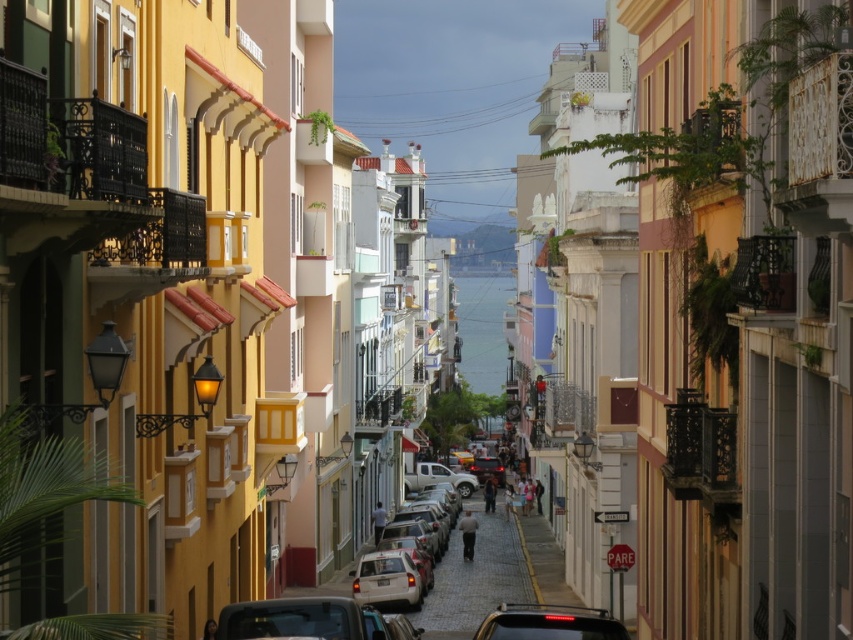
Question: Can you confirm if shiny black car at lower center is thinner than matte silver car at center?

Choices:
 (A) no
 (B) yes

Answer: (A)

Question: Which point appears farthest from the camera in this image?

Choices:
 (A) (376, 600)
 (B) (334, 600)
 (C) (502, 616)

Answer: (A)

Question: Does shiny black car at lower center come in front of matte silver car at center?

Choices:
 (A) no
 (B) yes

Answer: (B)

Question: Among these objects, which one is nearest to the camera?

Choices:
 (A) matte silver car at center
 (B) matte black car at center

Answer: (B)

Question: Can you confirm if shiny black car at lower center is positioned to the left of matte black car at center?

Choices:
 (A) no
 (B) yes

Answer: (B)

Question: Which point is farther from the camera taking this photo?

Choices:
 (A) (503, 624)
 (B) (379, 616)
 (C) (355, 595)

Answer: (C)